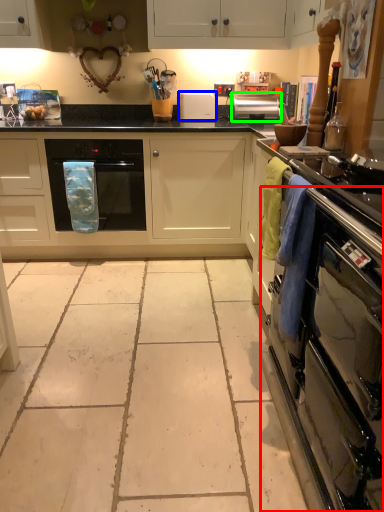
Question: Which is nearer to the oven (highlighted by a red box)? appliance (highlighted by a blue box) or kitchen appliance (highlighted by a green box).

Choices:
 (A) appliance
 (B) kitchen appliance

Answer: (B)